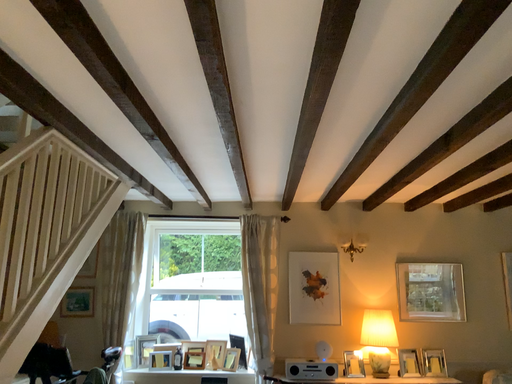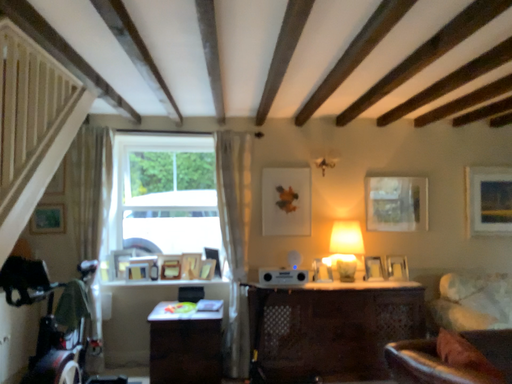
Question: Which way did the camera rotate in the video?

Choices:
 (A) rotated downward
 (B) rotated upward

Answer: (A)